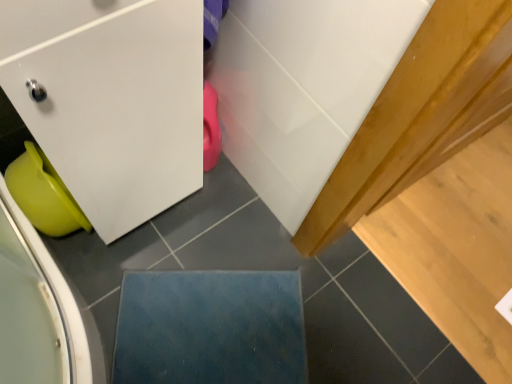
Question: Which is correct: matte green plastic toilet bowl at lower left is inside blue felt mat at lower center, or outside of it?

Choices:
 (A) inside
 (B) outside

Answer: (B)

Question: From the image's perspective, is matte green plastic toilet bowl at lower left above or below blue felt mat at lower center?

Choices:
 (A) above
 (B) below

Answer: (A)

Question: Visually, is matte green plastic toilet bowl at lower left positioned to the left or to the right of blue felt mat at lower center?

Choices:
 (A) right
 (B) left

Answer: (B)

Question: In the image, is blue felt mat at lower center positioned in front of or behind matte green plastic toilet bowl at lower left?

Choices:
 (A) behind
 (B) front

Answer: (A)

Question: From the image's perspective, relative to matte green plastic toilet bowl at lower left, is blue felt mat at lower center above or below?

Choices:
 (A) below
 (B) above

Answer: (A)

Question: Is blue felt mat at lower center inside or outside of matte green plastic toilet bowl at lower left?

Choices:
 (A) outside
 (B) inside

Answer: (A)

Question: Considering the positions of blue felt mat at lower center and matte green plastic toilet bowl at lower left in the image, is blue felt mat at lower center taller or shorter than matte green plastic toilet bowl at lower left?

Choices:
 (A) tall
 (B) short

Answer: (B)